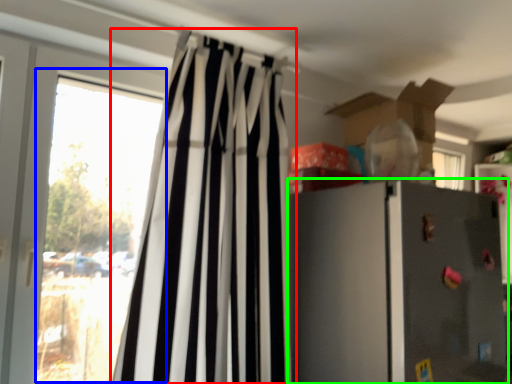
Question: Considering the real-world distances, which object is closest to curtain (highlighted by a red box)? window (highlighted by a blue box) or refrigerator (highlighted by a green box).

Choices:
 (A) window
 (B) refrigerator

Answer: (A)